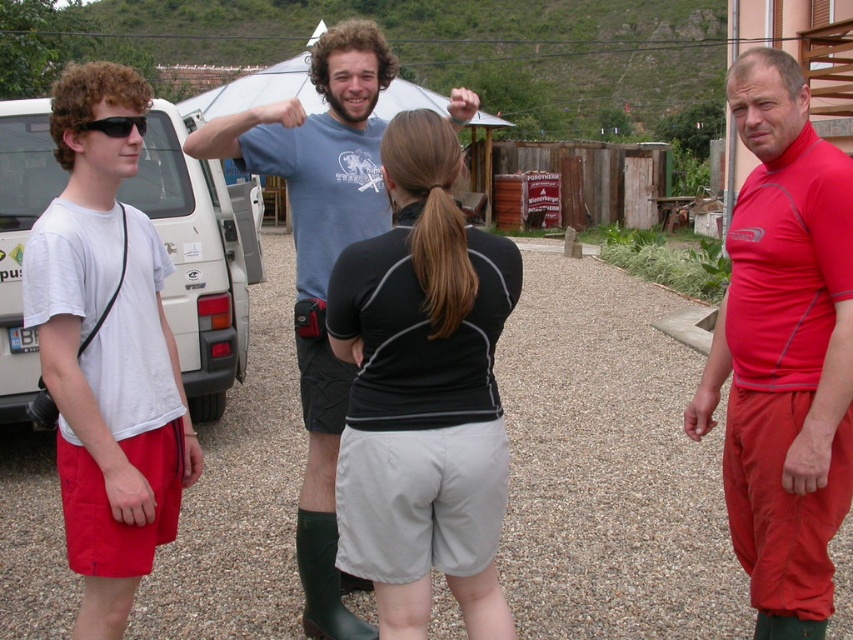
Looking at this image, you are a fashion designer observing the image. You need to determine which clothing item is more suitable for a compact storage case. Which of the following has a smaller size between the black matte shorts at center and the red matte pants at right?

The black matte shorts at center has a smaller size compared to the red matte pants at right, so it is more suitable for a compact storage case.